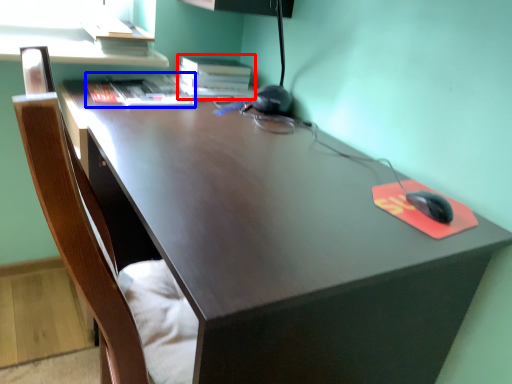
Question: Which point is closer to the camera, book (highlighted by a red box) or book (highlighted by a blue box)?

Choices:
 (A) book
 (B) book

Answer: (B)